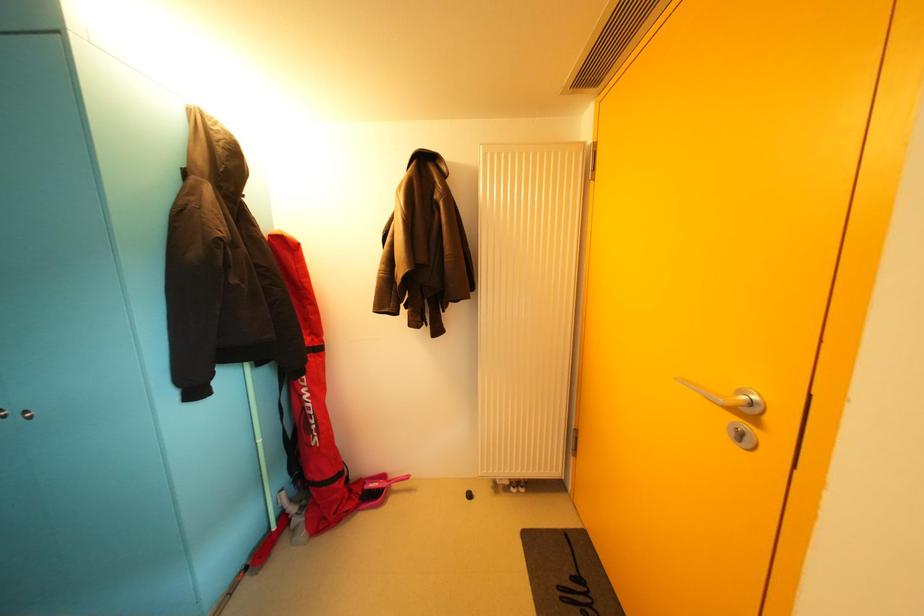
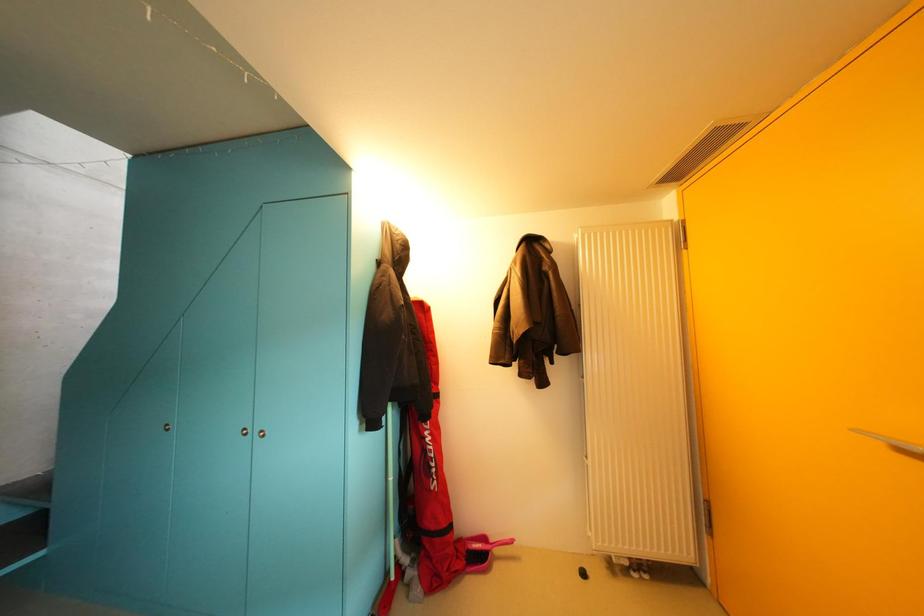
Question: The first image is from the beginning of the video and the second image is from the end. How did the camera likely rotate when shooting the video?

Choices:
 (A) Left
 (B) Right
 (C) Up
 (D) Down

Answer: (C)